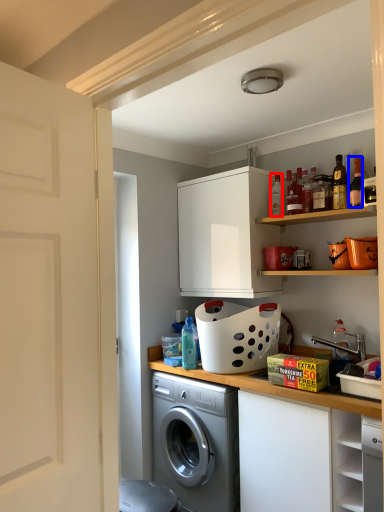
Question: Which object is further to the camera taking this photo, bottle (highlighted by a red box) or bottle (highlighted by a blue box)?

Choices:
 (A) bottle
 (B) bottle

Answer: (A)